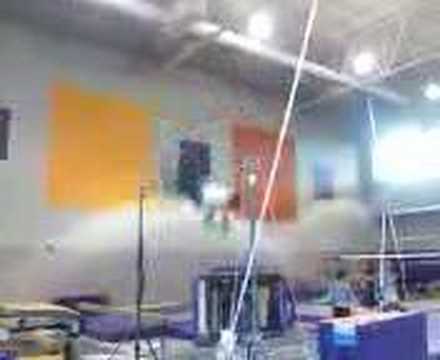
Locate an element on the screen. This screenshot has height=360, width=440. window is located at coordinates (415, 151).